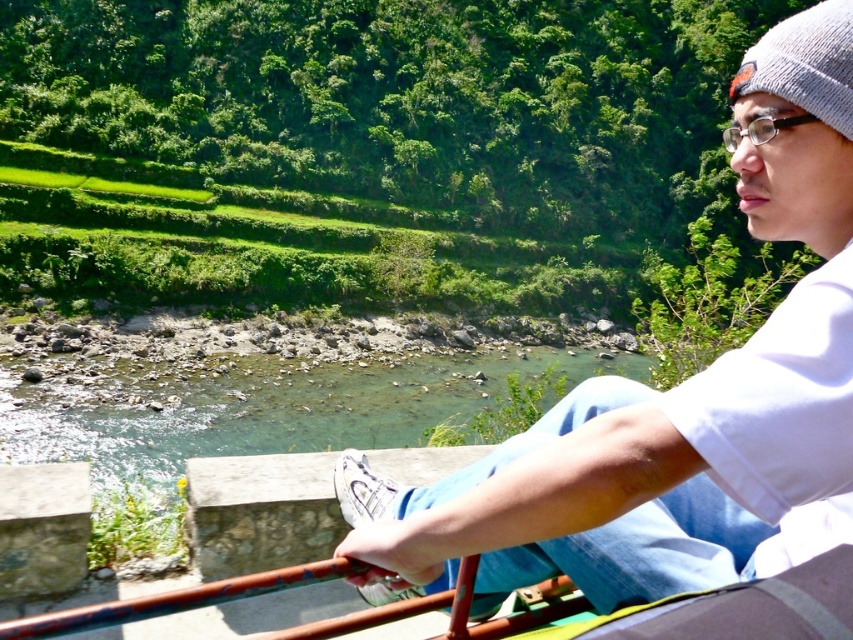
Is point (346, 570) farther from camera compared to point (820, 93)?

That is True.

Who is more forward, (541,582) or (805,42)?

Point (805,42) is in front.

This screenshot has width=853, height=640. I want to click on rusty metal rail at lower center, so click(x=172, y=600).

Does white cotton shirt at upper right have a lesser width compared to clear water at river center?

Yes, white cotton shirt at upper right is thinner than clear water at river center.

Which is in front, point (788, 99) or point (21, 403)?

Point (788, 99) is more forward.

Is point (465, 467) positioned after point (271, 388)?

No.

Locate an element on the screen. Image resolution: width=853 pixels, height=640 pixels. white cotton shirt at upper right is located at coordinates (677, 401).

This screenshot has width=853, height=640. Describe the element at coordinates (289, 410) in the screenshot. I see `clear water at river center` at that location.

From the picture: Between clear water at river center and rusty metal rail at lower center, which one has more height?

With more height is clear water at river center.

Is point (82, 444) less distant than point (16, 636)?

No, (82, 444) is further to viewer.

The width and height of the screenshot is (853, 640). I want to click on clear water at river center, so click(289, 410).